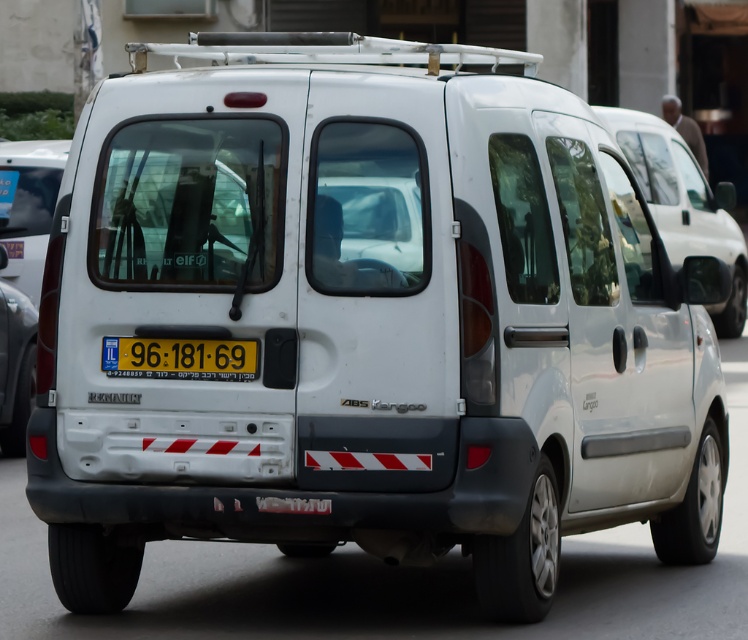
Does white matte van at center appear on the left side of yellow plastic license plate at center?

In fact, white matte van at center is to the right of yellow plastic license plate at center.

What do you see at coordinates (683, 204) in the screenshot? I see `white matte van at center` at bounding box center [683, 204].

Where is `white matte van at center`? The height and width of the screenshot is (640, 748). white matte van at center is located at coordinates (683, 204).